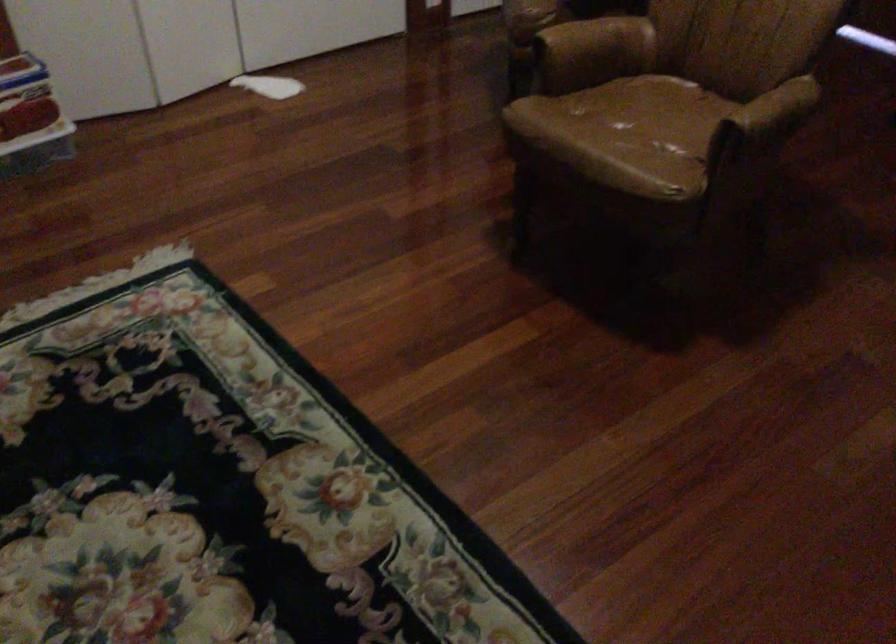
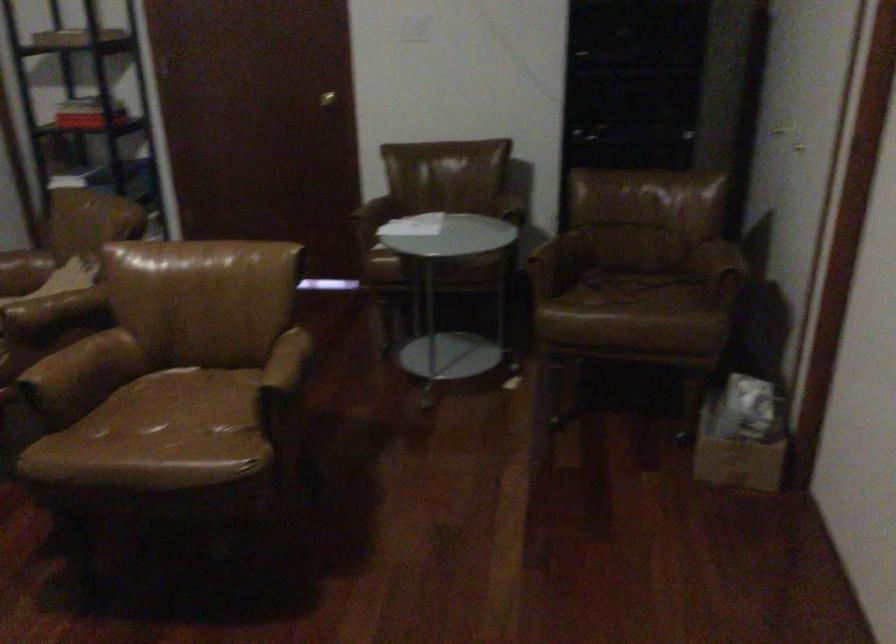
Find the pixel in the second image that matches (x=648, y=122) in the first image.

(178, 413)